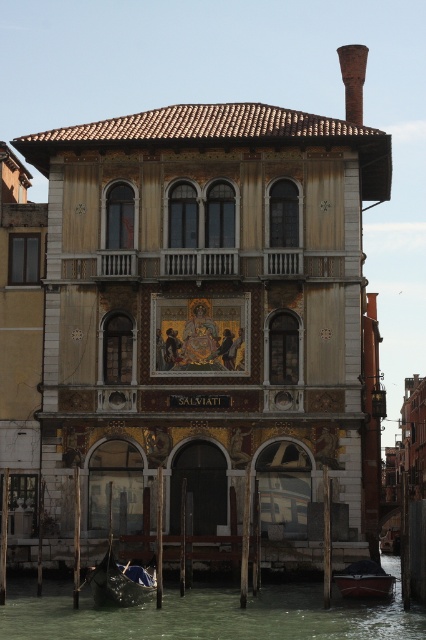
This screenshot has width=426, height=640. Describe the element at coordinates (120, 580) in the screenshot. I see `dark blue polished wood gondola at lower left` at that location.

Is point (98, 588) more distant than point (353, 586)?

No, it is in front of (353, 586).

The height and width of the screenshot is (640, 426). I want to click on dark blue polished wood gondola at lower left, so click(x=120, y=580).

Locate an element on the screen. This screenshot has height=640, width=426. dark blue polished wood gondola at lower left is located at coordinates (120, 580).

Between greenish water at lower center and dark blue polished wood gondola at lower left, which one appears on the right side from the viewer's perspective?

greenish water at lower center

Locate an element on the screen. Image resolution: width=426 pixels, height=640 pixels. greenish water at lower center is located at coordinates (210, 614).

Does greenish water at lower center have a larger size compared to dark blue wooden boat at lower center?

Indeed, greenish water at lower center has a larger size compared to dark blue wooden boat at lower center.

In the scene shown: Between greenish water at lower center and dark blue wooden boat at lower center, which one appears on the right side from the viewer's perspective?

dark blue wooden boat at lower center

Does point (58, 620) come behind point (367, 570)?

No, (58, 620) is closer to viewer.

Image resolution: width=426 pixels, height=640 pixels. Find the location of `greenish water at lower center`. greenish water at lower center is located at coordinates (210, 614).